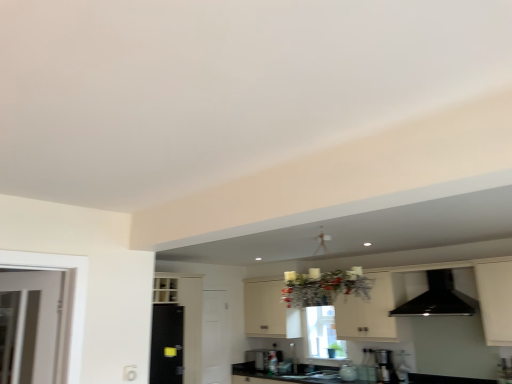
Question: Is black glossy exhaust hood at upper right inside black glossy sink at center, positioned as the first sink in top-to-bottom order?

Choices:
 (A) yes
 (B) no

Answer: (B)

Question: Is black glossy sink at center, positioned as the first sink in top-to-bottom order, smaller than black glossy exhaust hood at upper right?

Choices:
 (A) no
 (B) yes

Answer: (B)

Question: Is there a large distance between black glossy sink at center, acting as the second sink starting from the bottom, and black glossy exhaust hood at upper right?

Choices:
 (A) yes
 (B) no

Answer: (A)

Question: Considering the relative positions of black glossy sink at center, acting as the second sink starting from the bottom, and black glossy exhaust hood at upper right in the image provided, is black glossy sink at center, acting as the second sink starting from the bottom, behind black glossy exhaust hood at upper right?

Choices:
 (A) no
 (B) yes

Answer: (B)

Question: Considering the relative sizes of black glossy sink at center, acting as the second sink starting from the bottom, and black glossy exhaust hood at upper right in the image provided, is black glossy sink at center, acting as the second sink starting from the bottom, thinner than black glossy exhaust hood at upper right?

Choices:
 (A) yes
 (B) no

Answer: (A)

Question: From the image's perspective, is black glossy sink at center, acting as the second sink starting from the bottom, above black glossy exhaust hood at upper right?

Choices:
 (A) yes
 (B) no

Answer: (B)

Question: Is black granite countertop at lower center at the right side of white matte cabinet at center?

Choices:
 (A) no
 (B) yes

Answer: (A)

Question: From a real-world perspective, is black granite countertop at lower center over white matte cabinet at center?

Choices:
 (A) no
 (B) yes

Answer: (A)

Question: Could you tell me if black granite countertop at lower center is facing white matte cabinet at center?

Choices:
 (A) no
 (B) yes

Answer: (A)

Question: Is black granite countertop at lower center to the left of white matte cabinet at center from the viewer's perspective?

Choices:
 (A) yes
 (B) no

Answer: (A)

Question: Can you confirm if black granite countertop at lower center is bigger than white matte cabinet at center?

Choices:
 (A) no
 (B) yes

Answer: (A)

Question: Does black granite countertop at lower center have a greater width compared to white matte cabinet at center?

Choices:
 (A) no
 (B) yes

Answer: (B)

Question: Is black glossy sink at center, which is the second sink from top to bottom, facing towards metallic silver toaster at center?

Choices:
 (A) yes
 (B) no

Answer: (B)